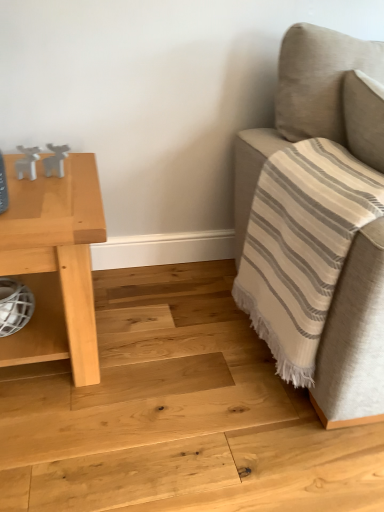
Where is `free space in front of white matte deer at upper left, which appears as the 1th toy when viewed from the right`? free space in front of white matte deer at upper left, which appears as the 1th toy when viewed from the right is located at coordinates (43, 202).